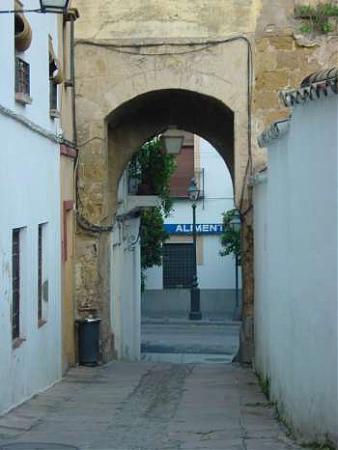
At what (x,y) coordinates should I click in order to perform the action: click on brick wall. Please return your answer as a coordinate pair (x, y). The height and width of the screenshot is (450, 338). Looking at the image, I should click on (279, 58).